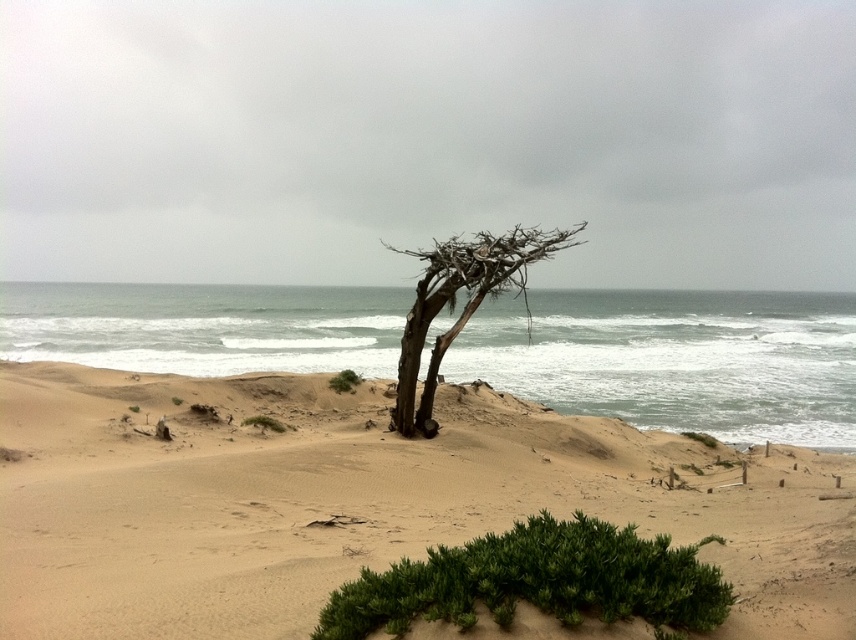
Question: Which object is farther from the camera taking this photo?

Choices:
 (A) brown rough tree at center
 (B) green leafy bush at lower center
 (C) sandy beige sand at center

Answer: (A)

Question: Can you confirm if sandy beige sand at center is positioned to the left of brown rough tree at center?

Choices:
 (A) no
 (B) yes

Answer: (B)

Question: Is sandy beige sand at center positioned before green leafy bush at lower center?

Choices:
 (A) no
 (B) yes

Answer: (A)

Question: Which of the following is the farthest from the observer?

Choices:
 (A) (706, 614)
 (B) (535, 246)
 (C) (807, 513)

Answer: (B)

Question: Which point is farther from the camera taking this photo?

Choices:
 (A) (161, 609)
 (B) (502, 548)

Answer: (A)

Question: Is sandy beige sand at center smaller than brown rough tree at center?

Choices:
 (A) no
 (B) yes

Answer: (B)